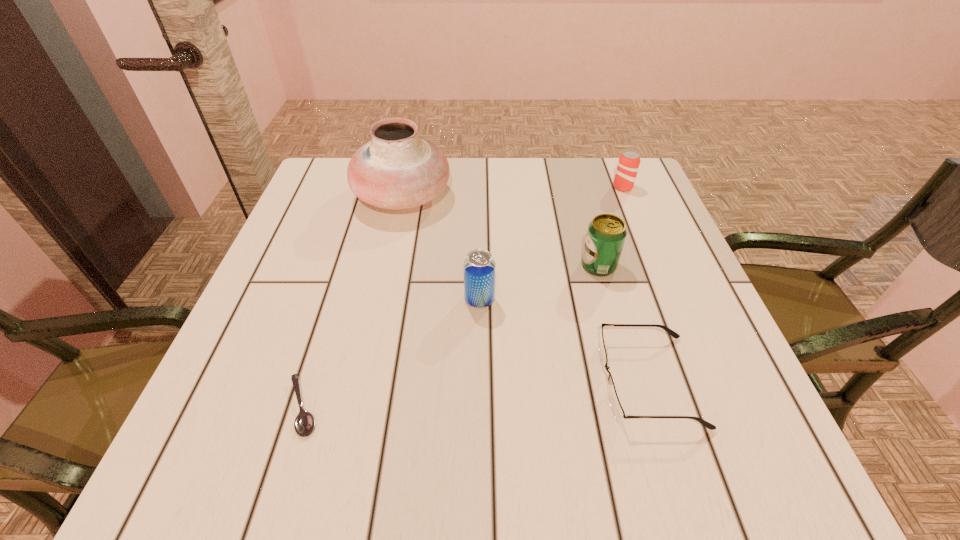
Locate an element on the screen. The image size is (960, 540). free point between the spectacles and the tallest object is located at coordinates (525, 288).

This screenshot has width=960, height=540. I want to click on unoccupied position between the farthest beer can and the shortest object, so click(463, 297).

At what (x,y) coordinates should I click in order to perform the action: click on empty space between the soupspoon and the second beer can from right to left. Please return your answer as a coordinate pair (x, y). The image size is (960, 540). Looking at the image, I should click on (451, 336).

This screenshot has width=960, height=540. Identify the location of free space between the soupspoon and the fourth nearest object. (451, 336).

At what (x,y) coordinates should I click in order to perform the action: click on the fifth closest object to the tallest object. Please return your answer as a coordinate pair (x, y). Looking at the image, I should click on (619, 414).

Locate which object ranks in proximity to the tallest object. Please provide its 2D coordinates. Your answer should be formatted as a tuple, i.e. [(x, y)], where the tuple contains the x and y coordinates of a point satisfying the conditions above.

[(479, 267)]

Image resolution: width=960 pixels, height=540 pixels. Find the location of `the third closest beer can to the tallest object`. the third closest beer can to the tallest object is located at coordinates (628, 164).

Locate which beer can ranks second in proximity to the spectacles. Please provide its 2D coordinates. Your answer should be formatted as a tuple, i.e. [(x, y)], where the tuple contains the x and y coordinates of a point satisfying the conditions above.

[(479, 267)]

Image resolution: width=960 pixels, height=540 pixels. In order to click on vacant position in the image that satisfies the following two spatial constraints: 1. on the back side of the fourth nearest object; 2. on the left side of the rightmost beer can in this screenshot , I will do `click(577, 187)`.

In order to click on vacant space that satisfies the following two spatial constraints: 1. on the back side of the second beer can from left to right; 2. on the right side of the fourth object from right to left in this screenshot , I will do `click(480, 266)`.